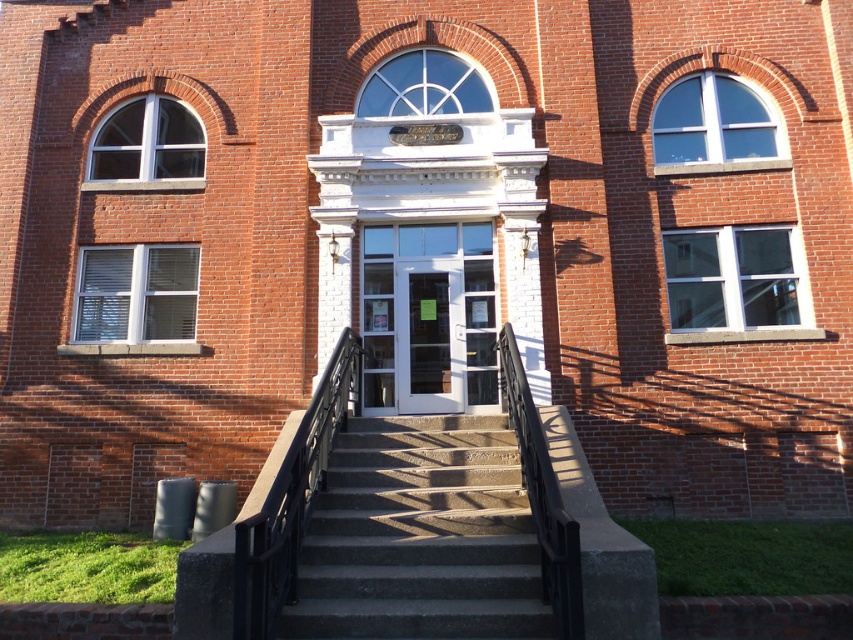
Question: Does concrete/steps at center have a smaller size compared to black metal/rail at center?

Choices:
 (A) yes
 (B) no

Answer: (A)

Question: Does concrete/steps at center appear under black metal/rail at center?

Choices:
 (A) no
 (B) yes

Answer: (B)

Question: Based on their relative distances, which object is nearer to the concrete/steps at center?

Choices:
 (A) black metal/rail at center
 (B) white glass door at center

Answer: (A)

Question: Among these points, which one is nearest to the camera?

Choices:
 (A) (279, 508)
 (B) (392, 332)

Answer: (A)

Question: Is concrete/steps at center to the right of black metal/rail at center from the viewer's perspective?

Choices:
 (A) yes
 (B) no

Answer: (A)

Question: Which is farther from the concrete/steps at center?

Choices:
 (A) white glass door at center
 (B) black metal/rail at center

Answer: (A)